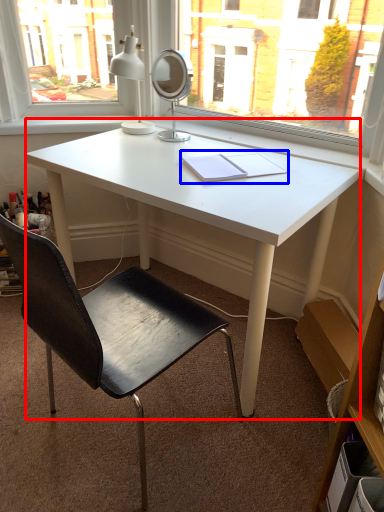
Question: Which object appears closest to the camera in this image, desk (highlighted by a red box) or notebook (highlighted by a blue box)?

Choices:
 (A) desk
 (B) notebook

Answer: (A)